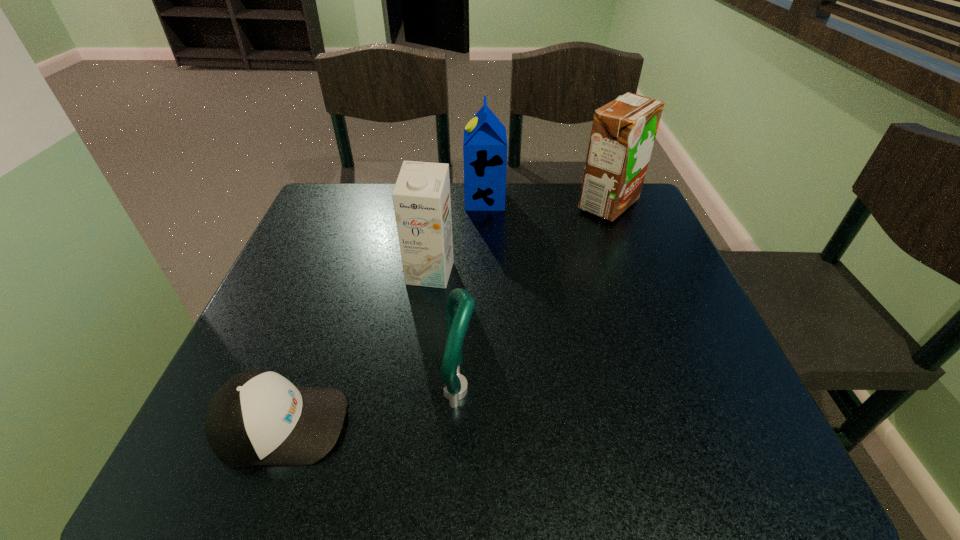
Find the location of `vacant space located 0.370m with the cap open on the second carton from left to right`. vacant space located 0.370m with the cap open on the second carton from left to right is located at coordinates (328, 200).

Where is `free space located 0.190m with the cap open on the second carton from left to right`? free space located 0.190m with the cap open on the second carton from left to right is located at coordinates (395, 200).

This screenshot has width=960, height=540. I want to click on vacant space situated 0.390m with the cap open on the second carton from left to right, so click(321, 200).

Locate an element on the screen. The height and width of the screenshot is (540, 960). vacant space located on the front of the third farthest object is located at coordinates (408, 446).

What are the coordinates of `vacant position located at the jaws of the bottle opener` in the screenshot? It's located at (523, 390).

Find the location of a particular element. The height and width of the screenshot is (540, 960). vacant space located 0.130m on the front panel of the leftmost object is located at coordinates coord(427,424).

At what (x,y) coordinates should I click in order to perform the action: click on bottle opener situated at the near edge. Please return your answer as a coordinate pair (x, y). The image size is (960, 540). Looking at the image, I should click on (460, 305).

The width and height of the screenshot is (960, 540). I want to click on cap that is at the near edge, so click(x=258, y=417).

In order to click on object present at the left edge in this screenshot , I will do `click(258, 417)`.

Identify the location of object located in the right edge section of the desktop. coord(623,132).